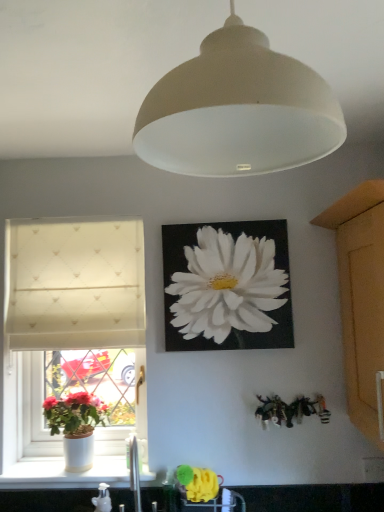
Question: Is white fabric window at left closer to camera compared to white textured curtain at left?

Choices:
 (A) yes
 (B) no

Answer: (A)

Question: From the image's perspective, is white fabric window at left under white textured curtain at left?

Choices:
 (A) no
 (B) yes

Answer: (B)

Question: From the image's perspective, is white fabric window at left over white textured curtain at left?

Choices:
 (A) yes
 (B) no

Answer: (B)

Question: Would you say white fabric window at left is a long distance from white textured curtain at left?

Choices:
 (A) yes
 (B) no

Answer: (B)

Question: From a real-world perspective, is white fabric window at left physically above white textured curtain at left?

Choices:
 (A) yes
 (B) no

Answer: (B)

Question: From their relative heights in the image, would you say white glossy sink at lower center is taller or shorter than white matte canvas at upper center?

Choices:
 (A) short
 (B) tall

Answer: (A)

Question: From the image's perspective, is white glossy sink at lower center above or below white matte canvas at upper center?

Choices:
 (A) below
 (B) above

Answer: (A)

Question: Is white glossy sink at lower center inside or outside of white matte canvas at upper center?

Choices:
 (A) inside
 (B) outside

Answer: (B)

Question: From a real-world perspective, is white glossy sink at lower center above or below white matte canvas at upper center?

Choices:
 (A) above
 (B) below

Answer: (B)

Question: In the image, is white glossy sink at lower center on the left side or the right side of white textured curtain at left?

Choices:
 (A) left
 (B) right

Answer: (B)

Question: In terms of height, does white glossy sink at lower center look taller or shorter compared to white textured curtain at left?

Choices:
 (A) tall
 (B) short

Answer: (B)

Question: In terms of size, does white glossy sink at lower center appear bigger or smaller than white textured curtain at left?

Choices:
 (A) small
 (B) big

Answer: (A)

Question: Relative to white textured curtain at left, is white glossy sink at lower center in front or behind?

Choices:
 (A) behind
 (B) front

Answer: (B)

Question: Is white fabric window at left in front of or behind white matte canvas at upper center in the image?

Choices:
 (A) behind
 (B) front

Answer: (A)

Question: Considering the positions of point (82, 370) and point (246, 287), is point (82, 370) closer or farther from the camera than point (246, 287)?

Choices:
 (A) closer
 (B) farther

Answer: (B)